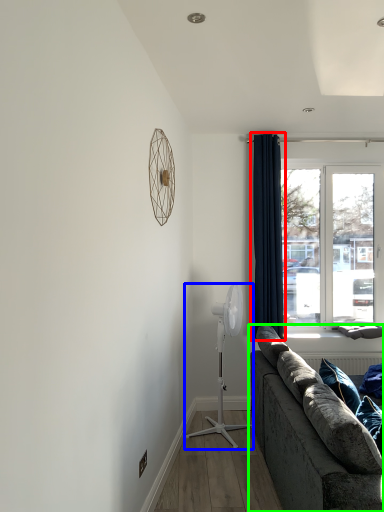
Question: Which object is positioned closest to curtain (highlighted by a red box)? Select from mechanical fan (highlighted by a blue box) and studio couch (highlighted by a green box).

Choices:
 (A) mechanical fan
 (B) studio couch

Answer: (A)